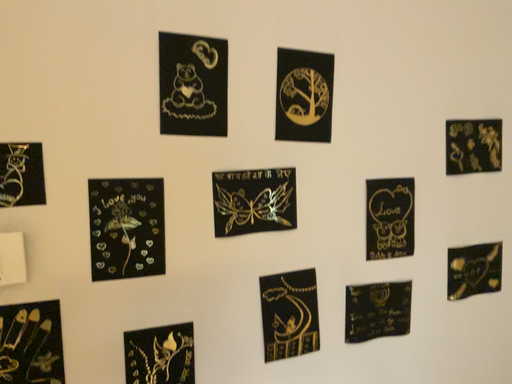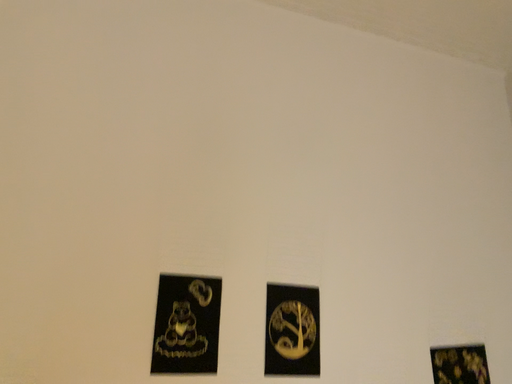
Question: How did the camera likely rotate when shooting the video?

Choices:
 (A) rotated upward
 (B) rotated downward

Answer: (A)